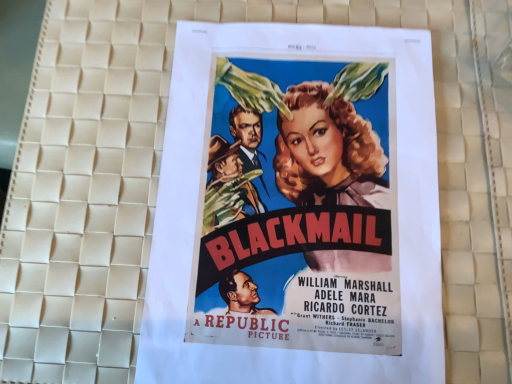
Locate an element on the screen. Image resolution: width=512 pixels, height=384 pixels. matte paper poster at center is located at coordinates (297, 210).

Describe the element at coordinates (297, 210) in the screenshot. This screenshot has width=512, height=384. I see `matte paper poster at center` at that location.

At what (x,y) coordinates should I click in order to perform the action: click on matte paper poster at center. Please return your answer as a coordinate pair (x, y). This screenshot has height=384, width=512. Looking at the image, I should click on (297, 210).